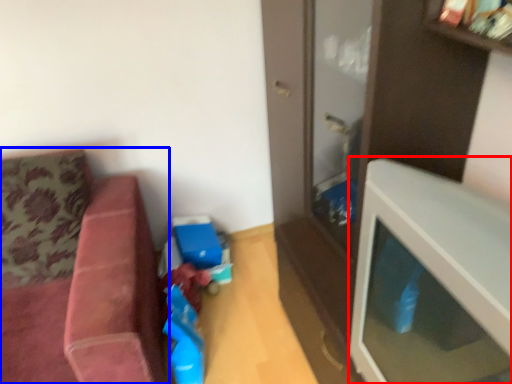
Question: Among these objects, which one is nearest to the camera, table (highlighted by a red box) or studio couch (highlighted by a blue box)?

Choices:
 (A) table
 (B) studio couch

Answer: (A)